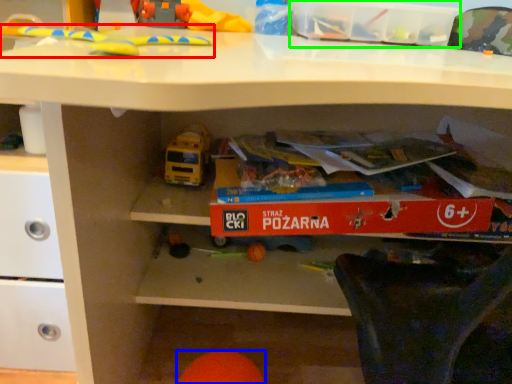
Question: Based on their relative distances, which object is nearer to toy (highlighted by a red box)? Choose from toy (highlighted by a blue box) and storage box (highlighted by a green box).

Choices:
 (A) toy
 (B) storage box

Answer: (B)